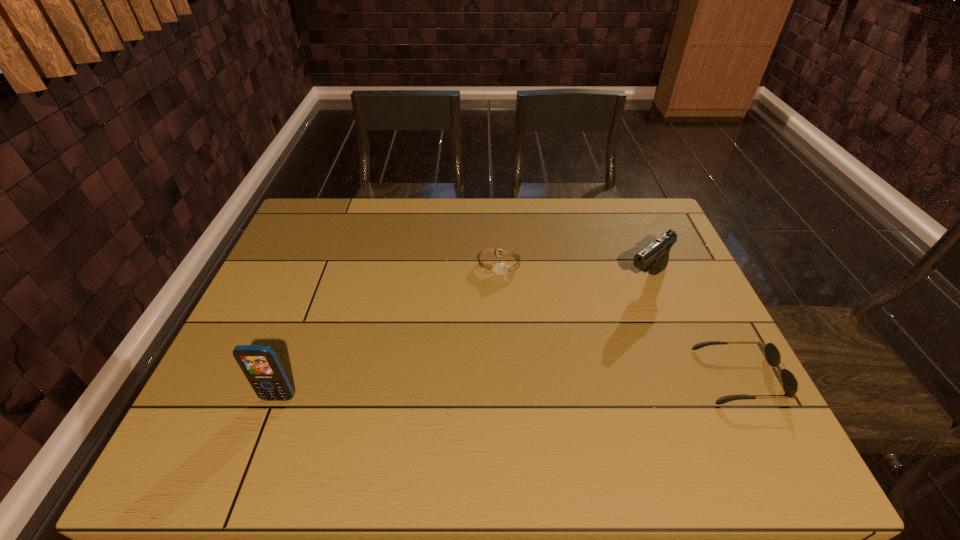
Where is `the leftmost object`? This screenshot has height=540, width=960. the leftmost object is located at coordinates (260, 364).

Locate an element on the screen. The height and width of the screenshot is (540, 960). the tallest object is located at coordinates (260, 364).

Locate an element on the screen. This screenshot has width=960, height=540. sunglasses is located at coordinates (772, 355).

In order to click on pistol in this screenshot , I will do `click(654, 258)`.

Find the location of a particular element. Image resolution: width=960 pixels, height=540 pixels. the second object from left to right is located at coordinates (500, 268).

I want to click on vacant space located 0.090m at the barrel of the third shortest object, so tap(612, 305).

Locate an element on the screen. The image size is (960, 540). free space located 0.400m at the barrel of the third shortest object is located at coordinates (532, 369).

Locate an element on the screen. This screenshot has width=960, height=540. vacant space located 0.300m at the barrel of the third shortest object is located at coordinates (560, 347).

You are a GUI agent. You are given a task and a screenshot of the screen. Output one action in this format:
    pyautogui.click(x=<x>, y=<y>)
    Task: Click on the free space located 0.060m on the face of the watch
    Image resolution: width=960 pixels, height=540 pixels.
    Given the screenshot: What is the action you would take?
    pyautogui.click(x=492, y=292)

Locate an element on the screen. This screenshot has width=960, height=540. vacant space located 0.380m on the face of the watch is located at coordinates (467, 391).